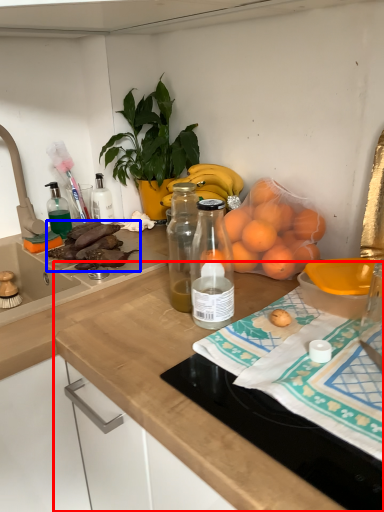
Question: Among these objects, which one is nearest to the camera, countertop (highlighted by a red box) or food (highlighted by a blue box)?

Choices:
 (A) countertop
 (B) food

Answer: (A)